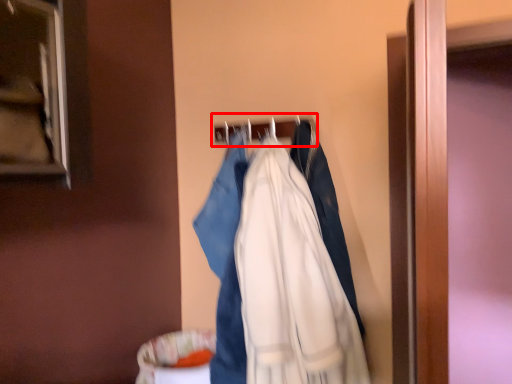
Question: Observing the image, what is the correct spatial positioning of hanger (annotated by the red box) in reference to fancy dress?

Choices:
 (A) left
 (B) right

Answer: (A)